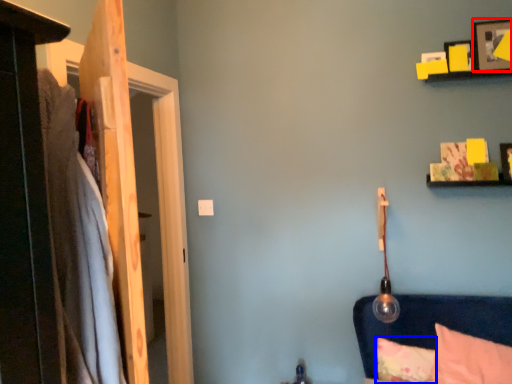
Question: Which object appears farthest to the camera in this image, picture frame (highlighted by a red box) or pillow (highlighted by a blue box)?

Choices:
 (A) picture frame
 (B) pillow

Answer: (B)